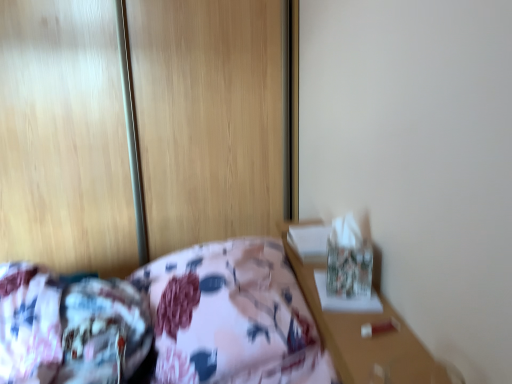
Question: Should I look upward or downward to see floral fabric mattress at lower left?

Choices:
 (A) down
 (B) up

Answer: (A)

Question: From the image's perspective, is floral fabric bed at center located above floral fabric mattress at lower left?

Choices:
 (A) yes
 (B) no

Answer: (A)

Question: From the image's perspective, is floral fabric bed at center beneath floral fabric mattress at lower left?

Choices:
 (A) no
 (B) yes

Answer: (A)

Question: From a real-world perspective, is floral fabric bed at center on floral fabric mattress at lower left?

Choices:
 (A) no
 (B) yes

Answer: (A)

Question: Can you confirm if floral fabric bed at center is taller than floral fabric mattress at lower left?

Choices:
 (A) no
 (B) yes

Answer: (B)

Question: Is floral fabric bed at center positioned in front of floral fabric mattress at lower left?

Choices:
 (A) yes
 (B) no

Answer: (B)

Question: Is floral fabric bed at center shorter than floral fabric mattress at lower left?

Choices:
 (A) yes
 (B) no

Answer: (B)

Question: From a real-world perspective, is floral fabric mattress at lower left beneath floral fabric bed at center?

Choices:
 (A) yes
 (B) no

Answer: (B)

Question: Does floral fabric mattress at lower left have a lesser width compared to floral fabric bed at center?

Choices:
 (A) yes
 (B) no

Answer: (A)

Question: Considering the relative sizes of floral fabric mattress at lower left and floral fabric bed at center in the image provided, is floral fabric mattress at lower left shorter than floral fabric bed at center?

Choices:
 (A) yes
 (B) no

Answer: (A)

Question: Is floral fabric mattress at lower left closer to the viewer compared to floral fabric bed at center?

Choices:
 (A) no
 (B) yes

Answer: (B)

Question: Is floral fabric mattress at lower left oriented away from floral fabric bed at center?

Choices:
 (A) no
 (B) yes

Answer: (B)

Question: Does floral fabric mattress at lower left have a greater height compared to floral fabric bed at center?

Choices:
 (A) yes
 (B) no

Answer: (B)

Question: Relative to floral fabric mattress at lower left, is floral fabric bed at center in front or behind?

Choices:
 (A) front
 (B) behind

Answer: (B)